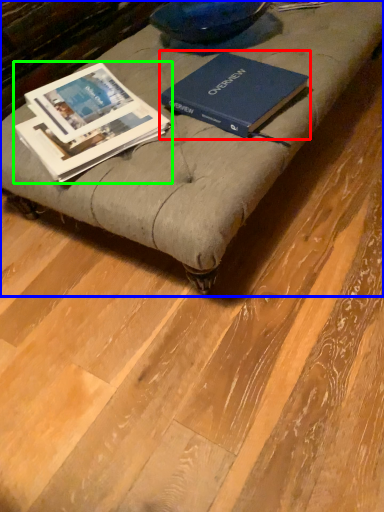
Question: Estimate the real-world distances between objects in this image. Which object is closer to book (highlighted by a red box), furniture (highlighted by a blue box) or book (highlighted by a green box)?

Choices:
 (A) furniture
 (B) book

Answer: (A)